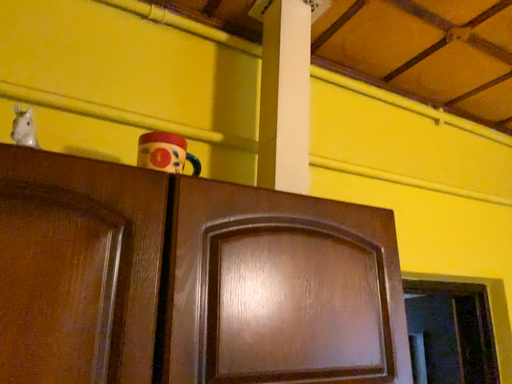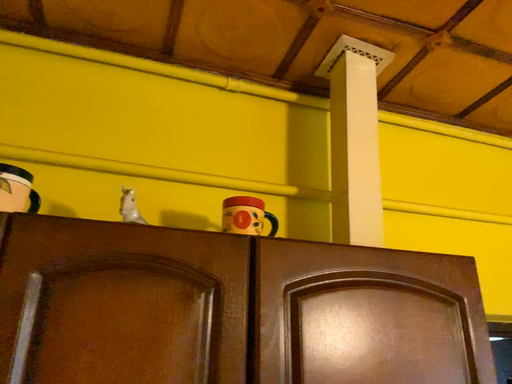
Question: How did the camera likely rotate when shooting the video?

Choices:
 (A) rotated left
 (B) rotated right

Answer: (A)